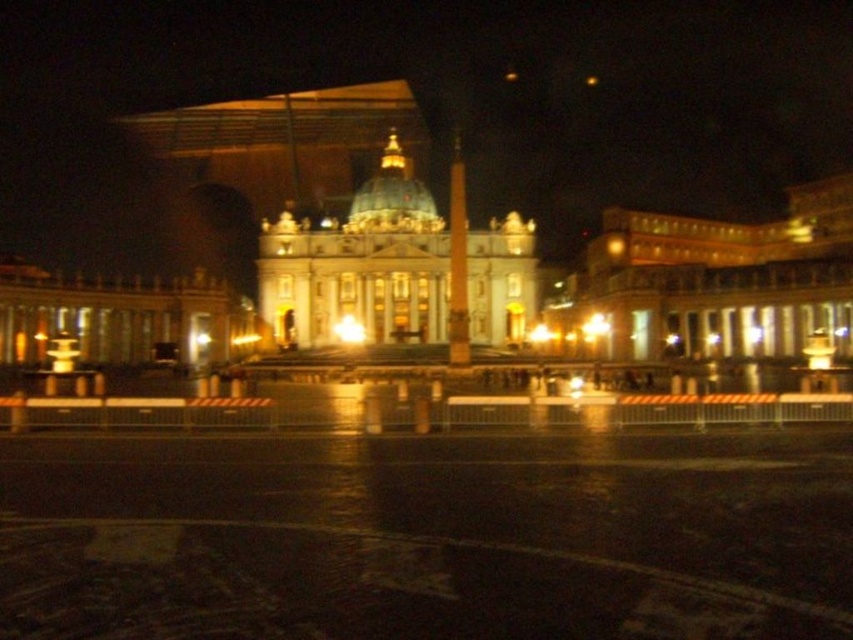
You are an architect visiting St. Peter Square and want to take a photo of the white marble palace at center and the matte gold obelisk at center. Based on their positions, which one should you focus on first if you want to capture both in the same frame without moving the camera?

The white marble palace at center is located below the matte gold obelisk at center, so you should focus on the matte gold obelisk at center first to ensure both are in the frame.

You are a tourist standing in the square in front of St. Peter Basilica. You want to take a photo of the light brown stone building at right and the matte gold obelisk at center. Which object is wider so that it can be captured fully in the frame without zooming in?

The light brown stone building at right is wider than the matte gold obelisk at center, so it requires a wider angle to capture fully without zooming in.